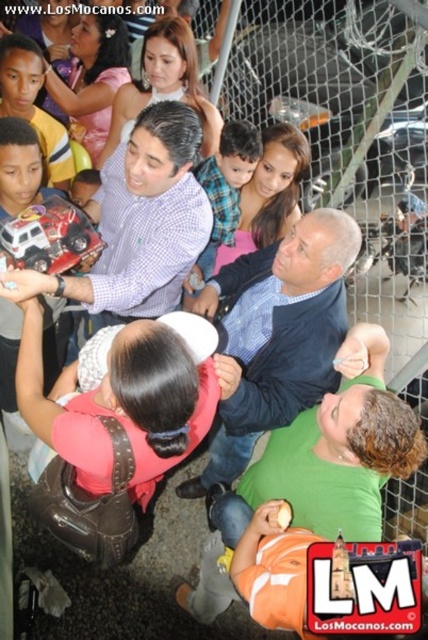
Question: Considering the relative positions of blue textured shirt at center and matte plaid shirt at center in the image provided, where is blue textured shirt at center located with respect to matte plaid shirt at center?

Choices:
 (A) below
 (B) above

Answer: (A)

Question: Which of the following is the closest to the observer?

Choices:
 (A) matte plaid shirt at center
 (B) blue textured shirt at center

Answer: (A)

Question: Which object appears farthest from the camera in this image?

Choices:
 (A) matte plaid shirt at center
 (B) blue textured shirt at center

Answer: (B)

Question: Can you confirm if blue textured shirt at center is thinner than matte plaid shirt at center?

Choices:
 (A) no
 (B) yes

Answer: (A)

Question: Where is blue textured shirt at center located in relation to matte plaid shirt at center in the image?

Choices:
 (A) right
 (B) left

Answer: (A)